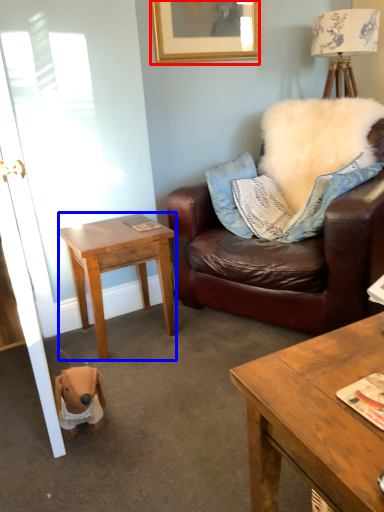
Question: Among these objects, which one is farthest to the camera, picture frame (highlighted by a red box) or desk (highlighted by a blue box)?

Choices:
 (A) picture frame
 (B) desk

Answer: (A)